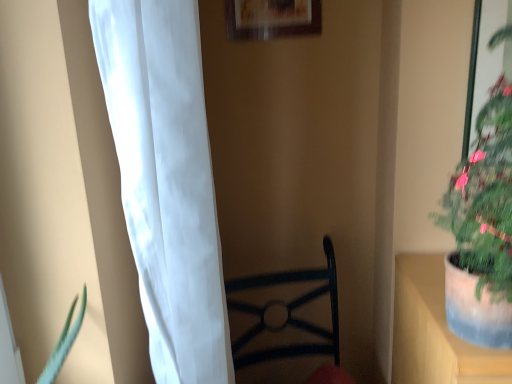
Question: Visually, is white sheer curtain at left positioned to the left or to the right of green matte plant at right?

Choices:
 (A) right
 (B) left

Answer: (B)

Question: Is white sheer curtain at left situated inside green matte plant at right or outside?

Choices:
 (A) outside
 (B) inside

Answer: (A)

Question: Considering the real-world distances, which object is closest to the green matte plant at right?

Choices:
 (A) wooden picture frame at upper center
 (B) white sheer curtain at left

Answer: (B)

Question: Estimate the real-world distances between objects in this image. Which object is farther from the white sheer curtain at left?

Choices:
 (A) green matte plant at right
 (B) wooden picture frame at upper center

Answer: (B)